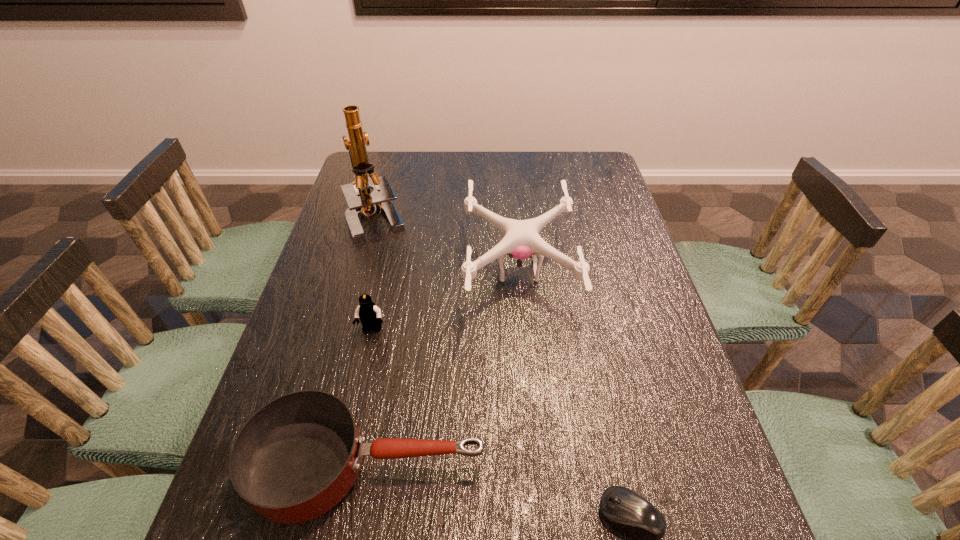
At what (x,y) coordinates should I click in order to perform the action: click on the tallest object. Please return your answer as a coordinate pair (x, y). The width and height of the screenshot is (960, 540). Looking at the image, I should click on (361, 201).

Image resolution: width=960 pixels, height=540 pixels. In order to click on drone in this screenshot , I will do `click(520, 239)`.

Find the location of `Lego`. Lego is located at coordinates click(369, 314).

At what (x,y) coordinates should I click in order to perform the action: click on the second shortest object. Please return your answer as a coordinate pair (x, y). The height and width of the screenshot is (540, 960). Looking at the image, I should click on (297, 457).

Where is `vacant space positioned 0.260m at the eyepiece of the microscope`? vacant space positioned 0.260m at the eyepiece of the microscope is located at coordinates (351, 312).

Locate an element on the screen. The image size is (960, 540). free space located 0.090m on the top of the second tallest object is located at coordinates (431, 271).

You are a GUI agent. You are given a task and a screenshot of the screen. Output one action in this format:
    pyautogui.click(x=<x>, y=<y>)
    Task: Click on the vacant space located 0.200m on the top of the second tallest object
    This screenshot has width=960, height=540.
    Given the screenshot: What is the action you would take?
    pyautogui.click(x=390, y=271)

You are a GUI agent. You are given a task and a screenshot of the screen. Output one action in this format:
    pyautogui.click(x=<x>, y=<y>)
    Task: Click on the vacant area situated 0.360m on the top of the second tallest object
    The width and height of the screenshot is (960, 540).
    Given the screenshot: What is the action you would take?
    pyautogui.click(x=331, y=271)

Image resolution: width=960 pixels, height=540 pixels. What are the coordinates of `free location located on the front-facing side of the Lego` in the screenshot? It's located at (337, 487).

At what (x,y) coordinates should I click in order to perform the action: click on free space located 0.380m on the handle side of the pan. Please return your answer as a coordinate pair (x, y). Looking at the image, I should click on (687, 465).